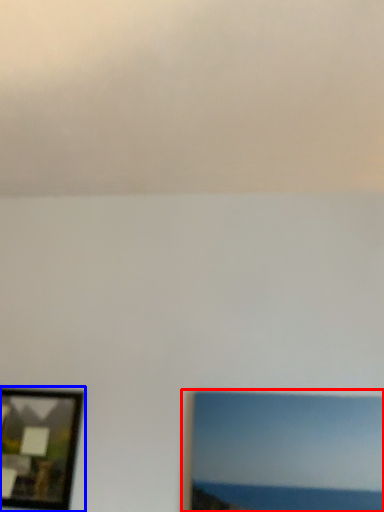
Question: Which of the following is the farthest to the observer, picture frame (highlighted by a red box) or picture frame (highlighted by a blue box)?

Choices:
 (A) picture frame
 (B) picture frame

Answer: (B)